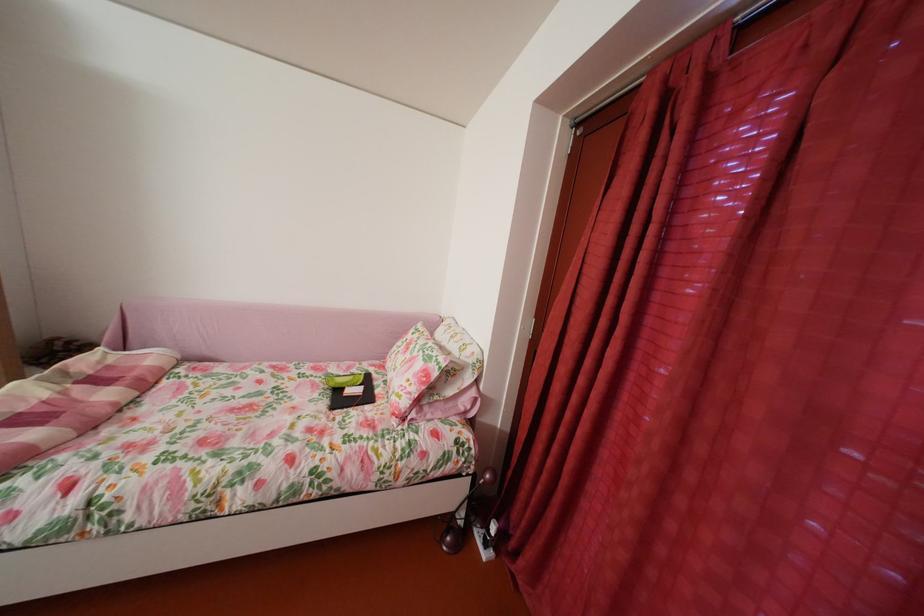
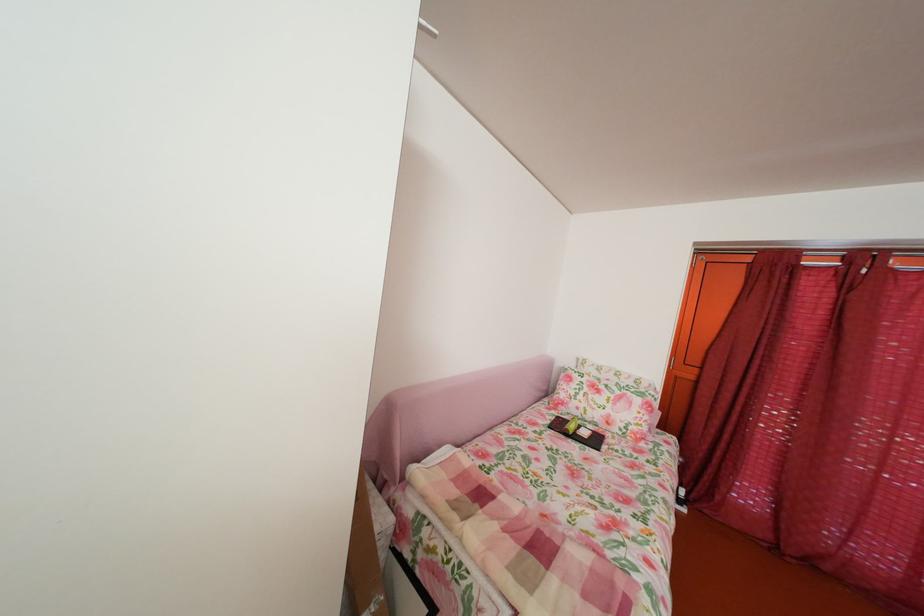
Question: What movement of the cameraman would produce the second image?

Choices:
 (A) Left
 (B) Right
 (C) Forward
 (D) Backward

Answer: (A)